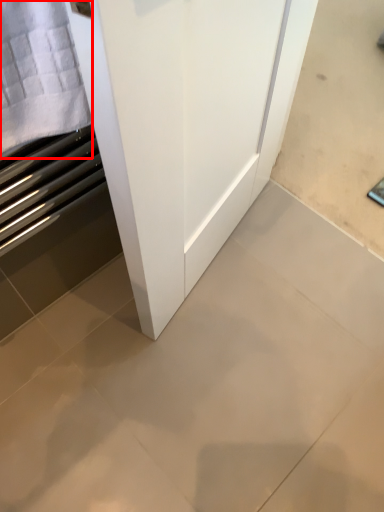
Question: In this image, where is cloth (annotated by the red box) located relative to ceramic tile?

Choices:
 (A) right
 (B) left

Answer: (B)